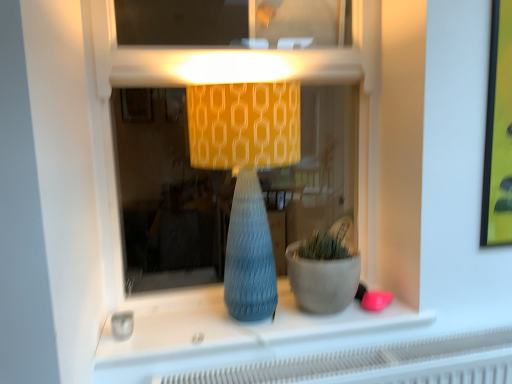
What do you see at coordinates (246, 176) in the screenshot?
I see `matte yellow fabric lampshade at center` at bounding box center [246, 176].

This screenshot has width=512, height=384. I want to click on matte gray vase at center, so click(229, 325).

From the image's perspective, is matte blue vase at center positioned above or below matte yellow fabric lampshade at center?

A: matte blue vase at center is situated higher than matte yellow fabric lampshade at center in the image.

Can you tell me how much matte blue vase at center and matte yellow fabric lampshade at center differ in facing direction?

The angular difference between matte blue vase at center and matte yellow fabric lampshade at center is 4.1 degrees.

From a real-world perspective, is matte blue vase at center located higher than matte yellow fabric lampshade at center?

Yes, from a real-world perspective, matte blue vase at center is above matte yellow fabric lampshade at center.

From a real-world perspective, between matte concrete flowerpot at center and matte yellow fabric lampshade at center, who is vertically lower?

matte concrete flowerpot at center is physically lower.

From the picture: Is matte concrete flowerpot at center not near matte yellow fabric lampshade at center?

No, there isn't a large distance between matte concrete flowerpot at center and matte yellow fabric lampshade at center.

Considering the sizes of matte concrete flowerpot at center and matte yellow fabric lampshade at center in the image, is matte concrete flowerpot at center taller or shorter than matte yellow fabric lampshade at center?

matte concrete flowerpot at center is shorter than matte yellow fabric lampshade at center.

Is matte concrete flowerpot at center oriented away from matte yellow fabric lampshade at center?

No, matte concrete flowerpot at center's orientation is not away from matte yellow fabric lampshade at center.

Is matte gray vase at center inside matte yellow fabric lampshade at center?

That's incorrect, matte gray vase at center is not inside matte yellow fabric lampshade at center.

Is matte yellow fabric lampshade at center directly adjacent to matte gray vase at center?

No.

Which object is thinner, matte yellow fabric lampshade at center or matte gray vase at center?

With smaller width is matte gray vase at center.

From a real-world perspective, which is physically below, matte yellow fabric lampshade at center or matte gray vase at center?

matte gray vase at center.

Does matte blue vase at center turn towards matte gray vase at center?

No, matte blue vase at center is not turned towards matte gray vase at center.

From a real-world perspective, which object rests below the other?

matte gray vase at center.

Is matte blue vase at center next to matte gray vase at center and touching it?

No, matte blue vase at center is not making contact with matte gray vase at center.

Does matte blue vase at center have a greater height compared to matte gray vase at center?

Yes, matte blue vase at center is taller than matte gray vase at center.

Based on the photo, is matte gray vase at center at the right side of matte blue vase at center?

Yes, matte gray vase at center is to the right of matte blue vase at center.

From the image's perspective, would you say matte gray vase at center is positioned over matte blue vase at center?

No, from the image's perspective, matte gray vase at center is not over matte blue vase at center.

Considering the sizes of objects matte gray vase at center and matte blue vase at center in the image provided, who is bigger, matte gray vase at center or matte blue vase at center?

With larger size is matte blue vase at center.

Is matte blue vase at center a part of matte yellow fabric lampshade at center?

No.

Who is shorter, matte yellow fabric lampshade at center or matte blue vase at center?

With less height is matte yellow fabric lampshade at center.

Can you tell me how much matte yellow fabric lampshade at center and matte blue vase at center differ in facing direction?

The facing directions of matte yellow fabric lampshade at center and matte blue vase at center are 4.1 degrees apart.

How much distance is there between matte concrete flowerpot at center and matte gray vase at center?

matte concrete flowerpot at center and matte gray vase at center are 7.52 inches apart from each other.

In terms of width, does matte concrete flowerpot at center look wider or thinner when compared to matte gray vase at center?

Clearly, matte concrete flowerpot at center has less width compared to matte gray vase at center.

Which object is more forward, matte concrete flowerpot at center or matte gray vase at center?

matte gray vase at center is closer to the camera.

Find the location of `shop window to the right of matte yellow fabric lampshade at center`. shop window to the right of matte yellow fabric lampshade at center is located at coordinates (258, 80).

In the image, there is a matte yellow fabric lampshade at center. Find the location of `flowerpot below it (from a real-world perspective)`. flowerpot below it (from a real-world perspective) is located at coordinates (322, 281).

Considering their positions, is matte concrete flowerpot at center positioned further to matte yellow fabric lampshade at center than matte gray vase at center?

matte gray vase at center.

Considering their positions, is matte blue vase at center positioned further to matte concrete flowerpot at center than matte yellow fabric lampshade at center?

Based on the image, matte blue vase at center appears to be further to matte concrete flowerpot at center.

Based on their spatial positions, is matte gray vase at center or matte blue vase at center closer to matte concrete flowerpot at center?

matte gray vase at center.

Based on their spatial positions, is matte concrete flowerpot at center or matte blue vase at center closer to matte gray vase at center?

matte concrete flowerpot at center lies closer to matte gray vase at center than the other object.

Estimate the real-world distances between objects in this image. Which object is further from matte blue vase at center, matte concrete flowerpot at center or matte yellow fabric lampshade at center?

matte concrete flowerpot at center lies further to matte blue vase at center than the other object.

Based on their spatial positions, is matte yellow fabric lampshade at center or matte concrete flowerpot at center closer to matte blue vase at center?

matte yellow fabric lampshade at center lies closer to matte blue vase at center than the other object.

From the image, which object appears to be nearer to matte yellow fabric lampshade at center, matte concrete flowerpot at center or matte blue vase at center?

matte concrete flowerpot at center.

Looking at the image, which one is located further to matte yellow fabric lampshade at center, matte gray vase at center or matte blue vase at center?

The object further to matte yellow fabric lampshade at center is matte blue vase at center.

Locate an element on the screen. lamp between matte blue vase at center and matte concrete flowerpot at center from top to bottom is located at coordinates (246, 176).

At what (x,y) coordinates should I click in order to perform the action: click on flowerpot between matte blue vase at center and matte gray vase at center from top to bottom. Please return your answer as a coordinate pair (x, y). The image size is (512, 384). Looking at the image, I should click on (322, 281).

Image resolution: width=512 pixels, height=384 pixels. In order to click on lamp between matte blue vase at center and matte gray vase at center from top to bottom in this screenshot , I will do point(246,176).

I want to click on flowerpot between matte yellow fabric lampshade at center and matte gray vase at center in the up-down direction, so click(322, 281).